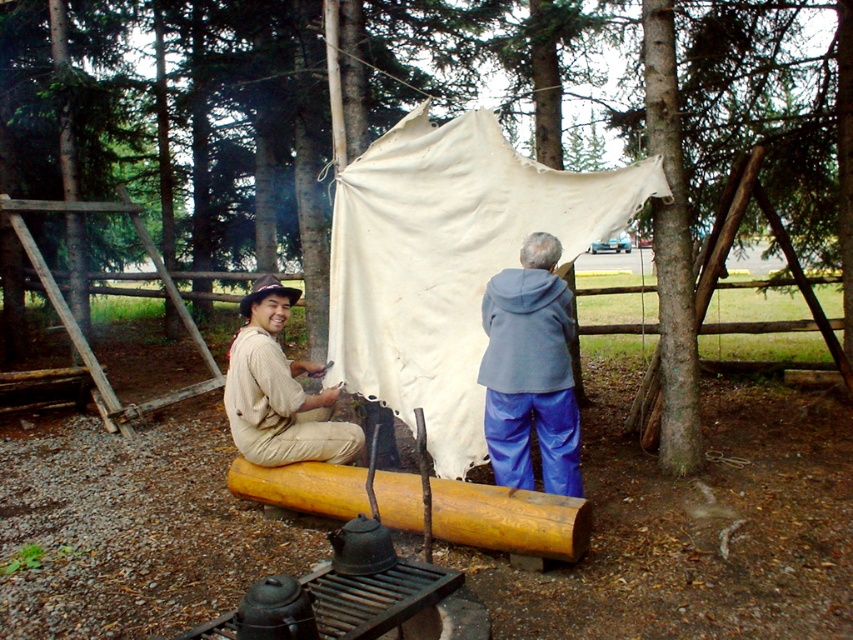
You are standing at the campsite and want to place a small flag exactly halfway between point [564,209] and point [502,320]. Which point is closer to the flag once it is placed?

The flag will be placed exactly halfway between the two points. Since point [502,320] is closer to the center of the campsite, it will be closer to the flag than point [564,209].

You are setting up a campsite and have a white canvas tent at center and blue rubber pants at center. According to the scene, which item is positioned higher relative to the other?

The white canvas tent at center is above the blue rubber pants at center, so the white canvas tent at center is positioned higher.

You are setting up a campsite and need to place a new firewood pile between the white canvas tent at center and the yellow wood log at center. Which object should the firewood be closer to if you want it to be closer to the viewer?

The firewood should be placed closer to the white canvas tent at center because it is already further to the viewer than the yellow wood log at center, so positioning the firewood near it would keep it closer to the viewer.